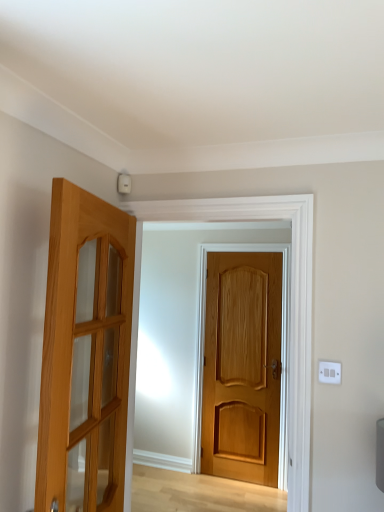
Question: From a real-world perspective, relative to white plastic switch at upper right, is light brown wooden door at center, acting as the 2th door starting from the left, vertically above or below?

Choices:
 (A) below
 (B) above

Answer: (A)

Question: Relative to white plastic switch at upper right, is light brown wooden door at center, the first door viewed from the right, in front or behind?

Choices:
 (A) behind
 (B) front

Answer: (A)

Question: Which is farther from the light brown wooden door at left, marked as the 2th door in a back-to-front arrangement?

Choices:
 (A) light brown wooden door at center, arranged as the second door when viewed from the front
 (B) white plastic switch at upper right

Answer: (A)

Question: Which is nearer to the light brown wooden door at left, positioned as the first door in left-to-right order?

Choices:
 (A) light brown wooden door at center, the 1th door positioned from the back
 (B) white plastic switch at upper right

Answer: (B)